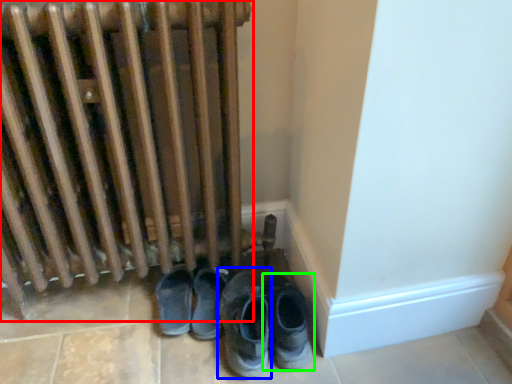
Question: Which is farther away from radiator (highlighted by a red box)? footwear (highlighted by a blue box) or footwear (highlighted by a green box)?

Choices:
 (A) footwear
 (B) footwear

Answer: (B)